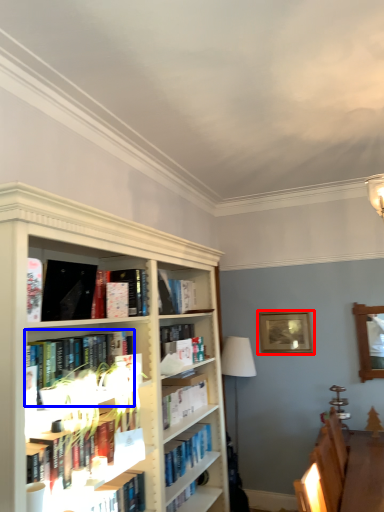
Question: Which point is further to the camera, picture frame (highlighted by a red box) or book (highlighted by a blue box)?

Choices:
 (A) picture frame
 (B) book

Answer: (A)